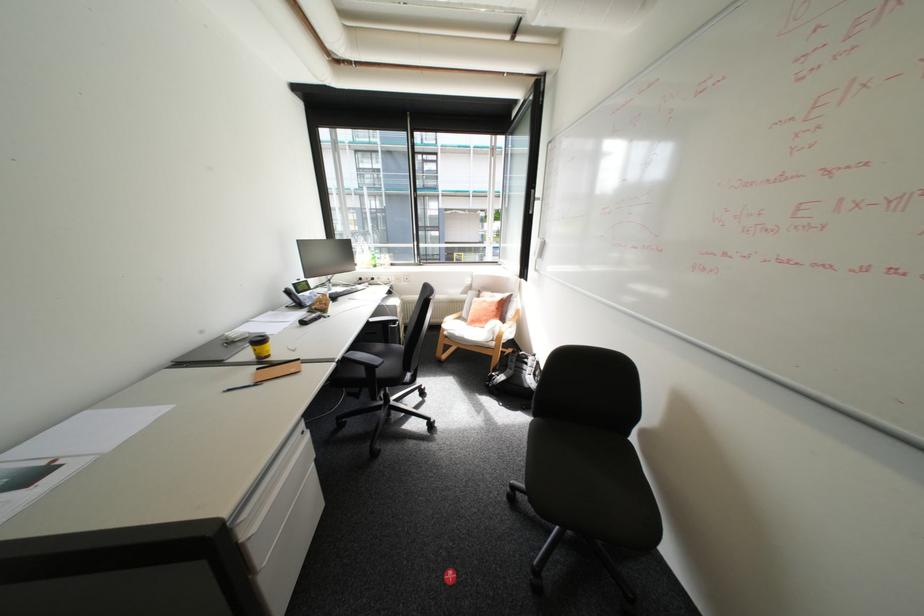
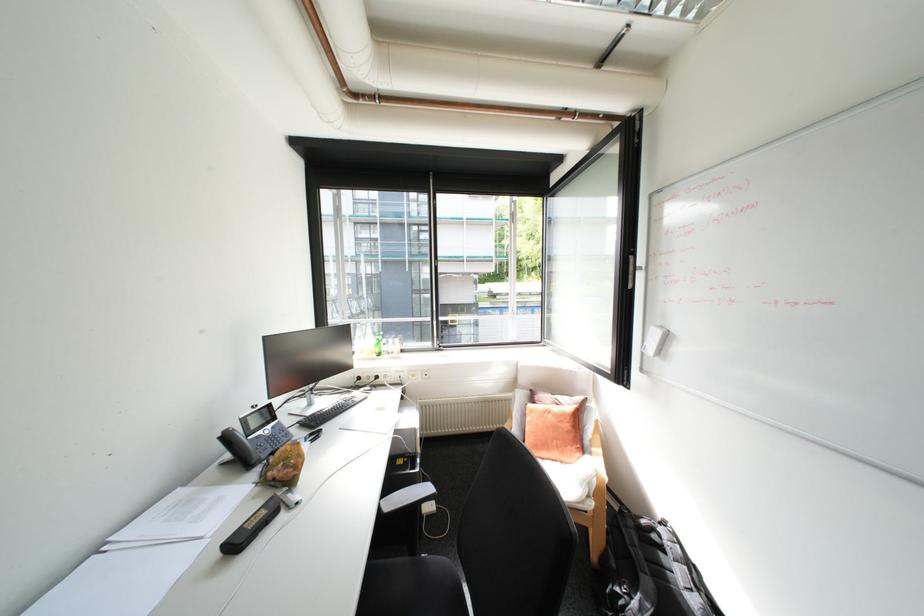
The point at [507,376] is marked in the first image. Where is the corresponding point in the second image?

(640, 598)